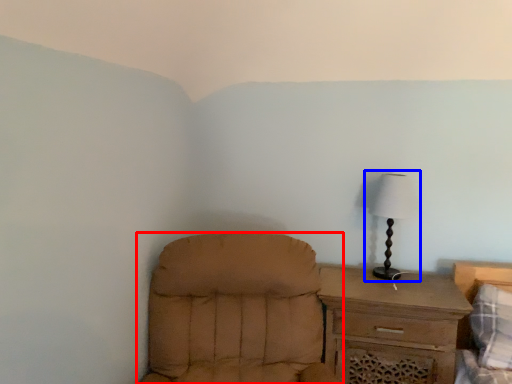
Question: Which object appears closest to the camera in this image, chair (highlighted by a red box) or lamp (highlighted by a blue box)?

Choices:
 (A) chair
 (B) lamp

Answer: (A)